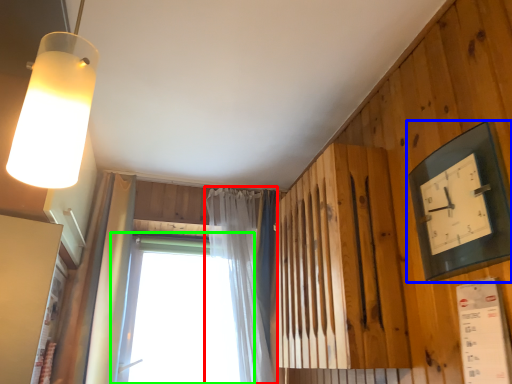
Question: Considering the real-world distances, which object is closest to curtain (highlighted by a red box)? clock (highlighted by a blue box) or window (highlighted by a green box).

Choices:
 (A) clock
 (B) window

Answer: (B)